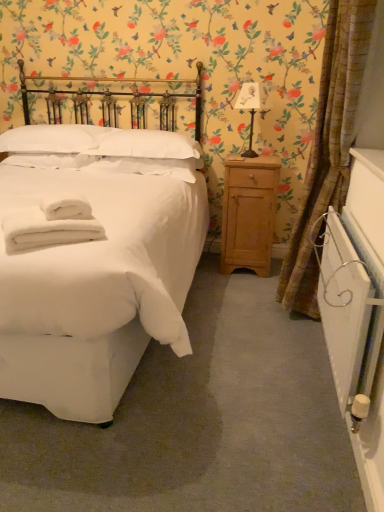
Question: Considering the relative positions of white paper lampshade at upper right and light wood/roughnightstand at right in the image provided, is white paper lampshade at upper right behind light wood/roughnightstand at right?

Choices:
 (A) yes
 (B) no

Answer: (B)

Question: From a real-world perspective, is white paper lampshade at upper right positioned under light wood/roughnightstand at right based on gravity?

Choices:
 (A) no
 (B) yes

Answer: (A)

Question: From the image's perspective, is white paper lampshade at upper right below light wood/roughnightstand at right?

Choices:
 (A) yes
 (B) no

Answer: (B)

Question: Is white paper lampshade at upper right at the right side of light wood/roughnightstand at right?

Choices:
 (A) yes
 (B) no

Answer: (A)

Question: Can you confirm if white paper lampshade at upper right is thinner than light wood/roughnightstand at right?

Choices:
 (A) yes
 (B) no

Answer: (A)

Question: From the image's perspective, is white paper lampshade at upper right located above light wood/roughnightstand at right?

Choices:
 (A) no
 (B) yes

Answer: (B)

Question: From a real-world perspective, is light wood/roughnightstand at right positioned over white paper lampshade at upper right based on gravity?

Choices:
 (A) yes
 (B) no

Answer: (B)

Question: Could white paper lampshade at upper right be considered to be inside light wood/roughnightstand at right?

Choices:
 (A) no
 (B) yes

Answer: (A)

Question: Is the depth of light wood/roughnightstand at right less than that of white paper lampshade at upper right?

Choices:
 (A) no
 (B) yes

Answer: (A)

Question: Could you tell me if light wood/roughnightstand at right is turned towards white paper lampshade at upper right?

Choices:
 (A) no
 (B) yes

Answer: (A)

Question: Can you confirm if light wood/roughnightstand at right is positioned to the right of white paper lampshade at upper right?

Choices:
 (A) yes
 (B) no

Answer: (B)

Question: Can you confirm if light wood/roughnightstand at right is positioned to the left of white paper lampshade at upper right?

Choices:
 (A) yes
 (B) no

Answer: (A)

Question: Considering the relative sizes of white cotton bed at left and light wood/roughnightstand at right in the image provided, is white cotton bed at left shorter than light wood/roughnightstand at right?

Choices:
 (A) no
 (B) yes

Answer: (A)